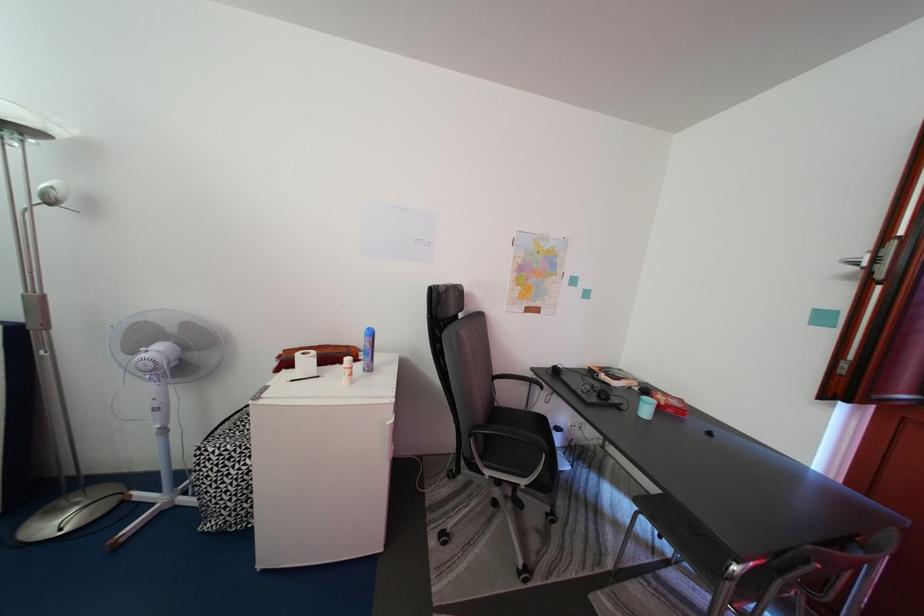
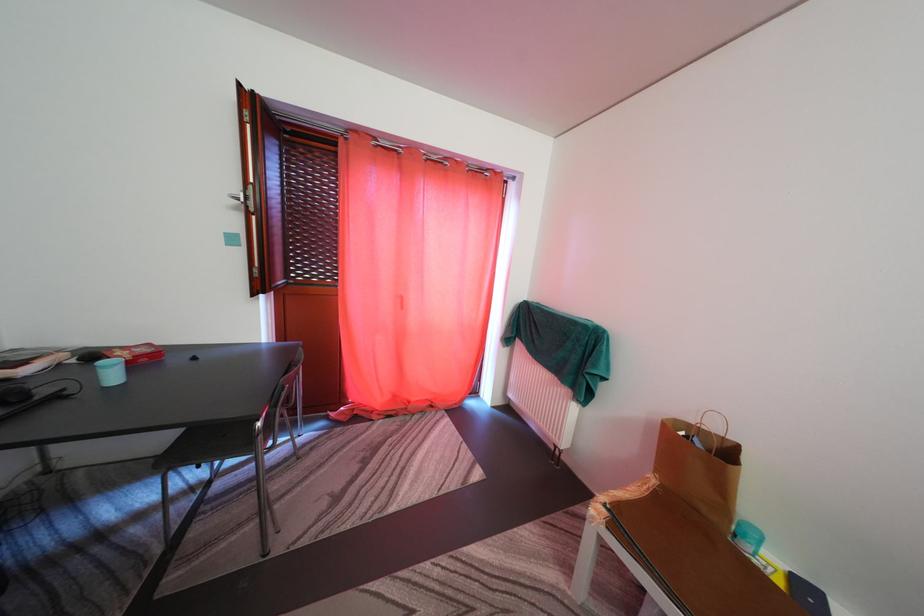
Where in the second image is the point corresponding to point (865, 270) from the first image?

(247, 206)